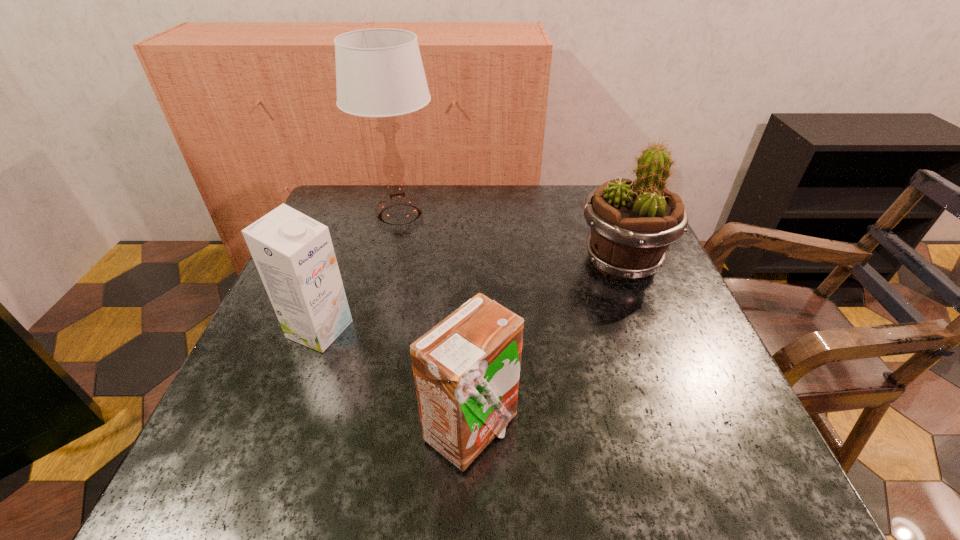
I want to click on object that is at the far edge, so click(x=379, y=72).

Where is `object present at the near edge`? The height and width of the screenshot is (540, 960). object present at the near edge is located at coordinates (466, 369).

The width and height of the screenshot is (960, 540). I want to click on table lamp that is at the left edge, so click(379, 72).

You are a GUI agent. You are given a task and a screenshot of the screen. Output one action in this format:
    pyautogui.click(x=<x>, y=<y>)
    Task: Click on the carton that is positioned at the left edge
    
    Given the screenshot: What is the action you would take?
    pyautogui.click(x=294, y=255)

Locate an element on the screen. object present at the right edge is located at coordinates (633, 223).

The height and width of the screenshot is (540, 960). Find the location of `object present at the far left corner`. object present at the far left corner is located at coordinates (379, 72).

Where is `free space at the far edge`? The height and width of the screenshot is (540, 960). free space at the far edge is located at coordinates (527, 232).

The height and width of the screenshot is (540, 960). What are the coordinates of `vacant space at the near edge of the desktop` in the screenshot? It's located at (305, 472).

The height and width of the screenshot is (540, 960). In order to click on vacant space at the left edge of the desktop in this screenshot , I will do `click(269, 364)`.

Locate an element on the screen. The height and width of the screenshot is (540, 960). blank space at the right edge is located at coordinates (705, 348).